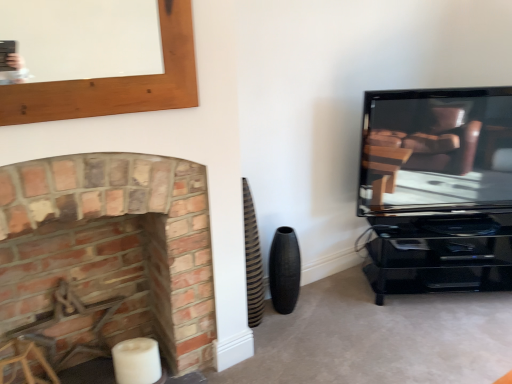
This screenshot has height=384, width=512. What do you see at coordinates (109, 253) in the screenshot?
I see `brick fireplace at left` at bounding box center [109, 253].

The width and height of the screenshot is (512, 384). Describe the element at coordinates (284, 270) in the screenshot. I see `black textured vase at lower center` at that location.

Locate an element on the screen. The height and width of the screenshot is (384, 512). black textured vase at lower center is located at coordinates (284, 270).

Where is `matte black tv at right`? This screenshot has height=384, width=512. matte black tv at right is located at coordinates (436, 150).

The image size is (512, 384). I want to click on metallic brown swivel chair at left, so click(x=69, y=316).

Consider the image. Is matte black tv at right at the right side of black textured vase at lower center?

Indeed, matte black tv at right is positioned on the right side of black textured vase at lower center.

Where is `television above the black textured vase at lower center (from a real-world perspective)`? The height and width of the screenshot is (384, 512). television above the black textured vase at lower center (from a real-world perspective) is located at coordinates (436, 150).

From a real-world perspective, relative to black textured vase at lower center, is matte black tv at right vertically above or below?

In terms of real-world spatial position, matte black tv at right is above black textured vase at lower center.

From the image's perspective, between matte black tv at right and black textured vase at lower center, which one is located above?

matte black tv at right appears higher in the image.

Is point (503, 121) farther from viewer compared to point (104, 314)?

Yes.

How many degrees apart are the facing directions of matte black tv at right and metallic brown swivel chair at left?

There is a 27.3-degree angle between the facing directions of matte black tv at right and metallic brown swivel chair at left.

Is matte black tv at right in front of or behind metallic brown swivel chair at left in the image?

In the image, matte black tv at right appears behind metallic brown swivel chair at left.

From the image's perspective, which object appears higher, matte black tv at right or metallic brown swivel chair at left?

matte black tv at right.

Is black textured vase at lower center at the right side of metallic brown swivel chair at left?

Indeed, black textured vase at lower center is positioned on the right side of metallic brown swivel chair at left.

Does black textured vase at lower center have a larger size compared to metallic brown swivel chair at left?

Indeed, black textured vase at lower center has a larger size compared to metallic brown swivel chair at left.

Is black textured vase at lower center not within metallic brown swivel chair at left?

Absolutely, black textured vase at lower center is external to metallic brown swivel chair at left.

At what (x,y) coordinates should I click in order to perform the action: click on swivel chair in front of the black textured vase at lower center. Please return your answer as a coordinate pair (x, y). The width and height of the screenshot is (512, 384). Looking at the image, I should click on point(69,316).

Is matte black tv at right oriented away from brick fireplace at left?

That's not correct — matte black tv at right is not looking away from brick fireplace at left.

Does matte black tv at right have a lesser width compared to brick fireplace at left?

Correct, the width of matte black tv at right is less than that of brick fireplace at left.

Does matte black tv at right come in front of brick fireplace at left?

That is False.

Considering the relative sizes of metallic brown swivel chair at left and brick fireplace at left in the image provided, is metallic brown swivel chair at left shorter than brick fireplace at left?

Yes.

Considering the relative positions of metallic brown swivel chair at left and brick fireplace at left in the image provided, is metallic brown swivel chair at left behind brick fireplace at left?

Yes.

Can you confirm if metallic brown swivel chair at left is positioned to the right of brick fireplace at left?

No.

From a real-world perspective, is metallic brown swivel chair at left beneath brick fireplace at left?

Correct, in the physical world, metallic brown swivel chair at left is lower than brick fireplace at left.

From a real-world perspective, is brick fireplace at left physically located above or below black textured vase at lower center?

brick fireplace at left is above black textured vase at lower center.

Which object is wider, brick fireplace at left or black textured vase at lower center?

brick fireplace at left is wider.

Which of these two, brick fireplace at left or black textured vase at lower center, stands taller?

brick fireplace at left is taller.

In the image, is brick fireplace at left positioned in front of or behind black textured vase at lower center?

brick fireplace at left is positioned closer to the viewer than black textured vase at lower center.

Is brick fireplace at left next to metallic brown swivel chair at left and touching it?

brick fireplace at left and metallic brown swivel chair at left are not in contact.

Is brick fireplace at left in front of metallic brown swivel chair at left?

Yes, brick fireplace at left is closer to the camera.

From a real-world perspective, between brick fireplace at left and metallic brown swivel chair at left, who is vertically lower?

From a 3D spatial view, metallic brown swivel chair at left is below.

Which point is more distant from viewer, (20, 211) or (58, 366)?

Point (58, 366)

Where is `television lying on the right of black textured vase at lower center`? The height and width of the screenshot is (384, 512). television lying on the right of black textured vase at lower center is located at coordinates pos(436,150).

Identify the location of swivel chair lying below the matte black tv at right (from the image's perspective). (69, 316).

When comparing their distances from metallic brown swivel chair at left, does brick fireplace at left or matte black tv at right seem further?

matte black tv at right is further to metallic brown swivel chair at left.

Looking at the image, which one is located closer to metallic brown swivel chair at left, brick fireplace at left or black textured vase at lower center?

brick fireplace at left is positioned closer to the anchor metallic brown swivel chair at left.

Based on their spatial positions, is metallic brown swivel chair at left or black textured vase at lower center further from matte black tv at right?

metallic brown swivel chair at left is further to matte black tv at right.

In the scene shown: Based on their spatial positions, is matte black tv at right or metallic brown swivel chair at left closer to brick fireplace at left?

Based on the image, metallic brown swivel chair at left appears to be nearer to brick fireplace at left.

From the image, which object appears to be farther from matte black tv at right, black textured vase at lower center or metallic brown swivel chair at left?

metallic brown swivel chair at left lies further to matte black tv at right than the other object.

Based on their spatial positions, is matte black tv at right or black textured vase at lower center further from brick fireplace at left?

Based on the image, matte black tv at right appears to be further to brick fireplace at left.

Estimate the real-world distances between objects in this image. Which object is closer to brick fireplace at left, black textured vase at lower center or metallic brown swivel chair at left?

metallic brown swivel chair at left is positioned closer to the anchor brick fireplace at left.

Estimate the real-world distances between objects in this image. Which object is closer to brick fireplace at left, metallic brown swivel chair at left or black textured vase at lower center?

Based on the image, metallic brown swivel chair at left appears to be nearer to brick fireplace at left.

Image resolution: width=512 pixels, height=384 pixels. In order to click on fireplace located between metallic brown swivel chair at left and matte black tv at right in the left-right direction in this screenshot , I will do coord(109,253).

This screenshot has width=512, height=384. I want to click on speaker between brick fireplace at left and matte black tv at right from left to right, so click(x=284, y=270).

Where is `fireplace between metallic brown swivel chair at left and black textured vase at lower center in the horizontal direction`? fireplace between metallic brown swivel chair at left and black textured vase at lower center in the horizontal direction is located at coordinates (109, 253).

The height and width of the screenshot is (384, 512). What are the coordinates of `speaker between metallic brown swivel chair at left and matte black tv at right in the horizontal direction` in the screenshot? It's located at (284, 270).